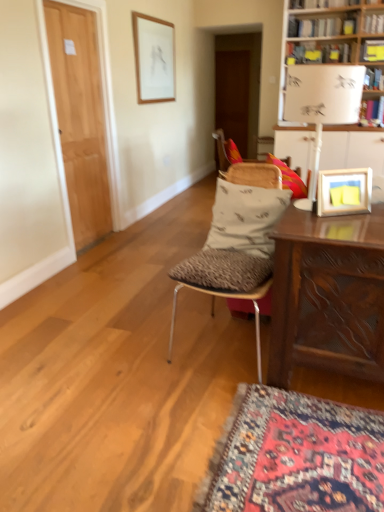
The width and height of the screenshot is (384, 512). What are the coordinates of `white paper lampshade at upper right` in the screenshot? It's located at (x=322, y=104).

What do you see at coordinates (322, 104) in the screenshot? I see `white paper lampshade at upper right` at bounding box center [322, 104].

This screenshot has height=512, width=384. I want to click on mahogany wood desk at right, so click(x=328, y=295).

Describe the element at coordinates (326, 34) in the screenshot. The width and height of the screenshot is (384, 512). I see `white cardboard bookcase at upper right` at that location.

Locate an element on the screen. yellow paper at upper right, arranged as the third book when viewed from the top is located at coordinates (372, 51).

Image resolution: width=384 pixels, height=512 pixels. I want to click on metallic silver chair at center, positioned as the 1th chair in front-to-back order, so click(x=225, y=282).

This screenshot has width=384, height=512. Identify the location of white paper lampshade at upper right. (322, 104).

From the image's perspective, is metallic silver chair at center, positioned as the 1th chair in front-to-back order, located beneath white cardboard bookcase at upper right?

Indeed, from the image's perspective, metallic silver chair at center, positioned as the 1th chair in front-to-back order, is shown beneath white cardboard bookcase at upper right.

Is metallic silver chair at center, positioned as the 1th chair in front-to-back order, wider or thinner than white cardboard bookcase at upper right?

metallic silver chair at center, positioned as the 1th chair in front-to-back order, is wider than white cardboard bookcase at upper right.

Is metallic silver chair at center, which ranks as the second chair in back-to-front order, closer to the viewer compared to white cardboard bookcase at upper right?

Yes, metallic silver chair at center, which ranks as the second chair in back-to-front order, is in front of white cardboard bookcase at upper right.

Are white fabric-covered chair at center, positioned as the second chair in front-to-back order, and light brown wood door at left, which is the 1th door in left-to-right order, making contact?

No, white fabric-covered chair at center, positioned as the second chair in front-to-back order, is not beside light brown wood door at left, which is the 1th door in left-to-right order.

Between white fabric-covered chair at center, the 1th chair when ordered from back to front, and light brown wood door at left, placed as the 2th door when sorted from back to front, which one has less height?

With less height is white fabric-covered chair at center, the 1th chair when ordered from back to front.

Is white fabric-covered chair at center, positioned as the second chair in front-to-back order, closer to camera compared to light brown wood door at left, placed as the 2th door when sorted from back to front?

No, it is behind light brown wood door at left, placed as the 2th door when sorted from back to front.

Is white fabric-covered chair at center, the 1th chair when ordered from back to front, facing towards light brown wood door at left, the 1th door in the bottom-to-top sequence?

No.

Is light brown wood door at left, which is the 1th door in left-to-right order, bigger than hardcover book at upper right, placed as the 3th book when sorted from bottom to top?

Indeed, light brown wood door at left, which is the 1th door in left-to-right order, has a larger size compared to hardcover book at upper right, placed as the 3th book when sorted from bottom to top.

Between light brown wood door at left, which is the 1th door in left-to-right order, and hardcover book at upper right, placed as the 3th book when sorted from bottom to top, which one has larger width?

With larger width is hardcover book at upper right, placed as the 3th book when sorted from bottom to top.

From a real-world perspective, is light brown wood door at left, the 1th door in the bottom-to-top sequence, on hardcover book at upper right, the 1th book when ordered from top to bottom?

No, from a real-world perspective, light brown wood door at left, the 1th door in the bottom-to-top sequence, is not above hardcover book at upper right, the 1th book when ordered from top to bottom.

From the image's perspective, between white paper lampshade at upper right and metallic silver chair at center, positioned as the 1th chair in front-to-back order, which one is located above?

white paper lampshade at upper right, from the image's perspective.

Is white paper lampshade at upper right at the left side of metallic silver chair at center, which ranks as the second chair in back-to-front order?

No, white paper lampshade at upper right is not to the left of metallic silver chair at center, which ranks as the second chair in back-to-front order.

The image size is (384, 512). Identify the location of lamp above the metallic silver chair at center, positioned as the 1th chair in front-to-back order (from the image's perspective). (322, 104).

Which of these two, white paper lampshade at upper right or metallic silver chair at center, positioned as the 1th chair in front-to-back order, is smaller?

With smaller size is white paper lampshade at upper right.

Does metallic silver chair at center, which ranks as the second chair in back-to-front order, turn towards matte white picture frame at upper center, the first picture frame from the left?

No, metallic silver chair at center, which ranks as the second chair in back-to-front order, is not turned towards matte white picture frame at upper center, the first picture frame from the left.

Which is in front, point (224, 262) or point (153, 102)?

The point (224, 262) is more forward.

Is metallic silver chair at center, which ranks as the second chair in back-to-front order, outside of matte white picture frame at upper center, the second picture frame ordered from the bottom?

Yes, metallic silver chair at center, which ranks as the second chair in back-to-front order, is located beyond the bounds of matte white picture frame at upper center, the second picture frame ordered from the bottom.

Which of these two, metallic silver chair at center, positioned as the 1th chair in front-to-back order, or matte white picture frame at upper center, the second picture frame ordered from the bottom, is smaller?

With smaller size is matte white picture frame at upper center, the second picture frame ordered from the bottom.

How many degrees apart are the facing directions of metallic silver chair at center, which ranks as the second chair in back-to-front order, and yellow paper at upper right, arranged as the third book when viewed from the top?

5.54 degrees separate the facing orientations of metallic silver chair at center, which ranks as the second chair in back-to-front order, and yellow paper at upper right, arranged as the third book when viewed from the top.

Is metallic silver chair at center, which ranks as the second chair in back-to-front order, far away from yellow paper at upper right, which ranks as the 1th book in bottom-to-top order?

Yes, metallic silver chair at center, which ranks as the second chair in back-to-front order, and yellow paper at upper right, which ranks as the 1th book in bottom-to-top order, are located far from each other.

Based on the photo, could yellow paper at upper right, arranged as the third book when viewed from the top, be considered to be inside metallic silver chair at center, positioned as the 1th chair in front-to-back order?

No, metallic silver chair at center, positioned as the 1th chair in front-to-back order, does not contain yellow paper at upper right, arranged as the third book when viewed from the top.

From the image's perspective, which is above, metallic silver chair at center, which ranks as the second chair in back-to-front order, or yellow paper at upper right, which ranks as the 1th book in bottom-to-top order?

yellow paper at upper right, which ranks as the 1th book in bottom-to-top order, appears higher in the image.

Does point (356, 278) appear closer or farther from the camera than point (378, 57)?

Point (356, 278) appears to be closer to the viewer than point (378, 57).

Which is correct: mahogany wood desk at right is inside yellow paper at upper right, arranged as the third book when viewed from the top, or outside of it?

mahogany wood desk at right cannot be found inside yellow paper at upper right, arranged as the third book when viewed from the top.

Identify the location of desk below the yellow paper at upper right, which ranks as the 1th book in bottom-to-top order (from a real-world perspective). The height and width of the screenshot is (512, 384). (328, 295).

I want to click on the 2nd chair in front of the white cardboard bookcase at upper right, so click(x=225, y=282).

Locate an element on the screen. Image resolution: width=384 pixels, height=512 pixels. the 1st chair below when counting from the light brown wood door at left, the second door positioned from the top (from the image's perspective) is located at coordinates (227, 151).

Which object lies nearer to the anchor point white fabric-covered chair at center, positioned as the second chair in front-to-back order, matte white picture frame at upper center, the first picture frame from the left, or hardcover book at upper right, the 1th book when ordered from top to bottom?

matte white picture frame at upper center, the first picture frame from the left, is closer to white fabric-covered chair at center, positioned as the second chair in front-to-back order.

Based on their spatial positions, is wooden picture frame at upper right, which is the 1th picture frame from right to left, or white fabric-covered chair at center, positioned as the second chair in front-to-back order, further from white cardboard bookcase at upper right?

white fabric-covered chair at center, positioned as the second chair in front-to-back order.

Which object lies nearer to the anchor point mahogany wood desk at right, wooden picture frame at upper right, the 1th picture frame positioned from the front, or white cardboard bookcase at upper right?

Based on the image, wooden picture frame at upper right, the 1th picture frame positioned from the front, appears to be nearer to mahogany wood desk at right.

In the scene shown: Which object lies nearer to the anchor point yellow paper at upper right, arranged as the third book when viewed from the top, white paper lampshade at upper right or matte white picture frame at upper center, the second picture frame positioned from the front?

white paper lampshade at upper right.

Based on the photo, which object lies further to the anchor point wooden picture frame at upper right, acting as the 2th picture frame starting from the top, metallic silver chair at center, positioned as the 1th chair in front-to-back order, or brown wooden door at center, marked as the second door in a front-to-back arrangement?

brown wooden door at center, marked as the second door in a front-to-back arrangement, is further to wooden picture frame at upper right, acting as the 2th picture frame starting from the top.

From the image, which object appears to be farther from light brown wood door at left, the 1th door viewed from the front, white paper lampshade at upper right or patterned fabric pillow at center?

white paper lampshade at upper right is further to light brown wood door at left, the 1th door viewed from the front.

Based on their spatial positions, is white wooden table at upper right or white fabric-covered chair at center, the 1th chair when ordered from back to front, further from yellow paper at upper right, arranged as the third book when viewed from the top?

white fabric-covered chair at center, the 1th chair when ordered from back to front.

From the image, which object appears to be farther from yellow paper at upper right, arranged as the third book when viewed from the top, mahogany wood desk at right or metallic silver chair at center, positioned as the 1th chair in front-to-back order?

metallic silver chair at center, positioned as the 1th chair in front-to-back order, is positioned further to the anchor yellow paper at upper right, arranged as the third book when viewed from the top.

Identify the location of bookcase located between metallic silver chair at center, which ranks as the second chair in back-to-front order, and hardcover book at upper center, which is the second book in top-to-bottom order, in the depth direction. The height and width of the screenshot is (512, 384). (326, 34).

You are a GUI agent. You are given a task and a screenshot of the screen. Output one action in this format:
    pyautogui.click(x=<x>, y=<y>)
    Task: Click on the chair between metallic silver chair at center, positioned as the 1th chair in front-to-back order, and matte white picture frame at upper center, the first picture frame positioned from the back, from front to back
    
    Given the screenshot: What is the action you would take?
    pyautogui.click(x=227, y=151)

What are the coordinates of `bookcase between white paper lampshade at upper right and yellow paper at upper right, arranged as the third book when viewed from the top, in the front-back direction` in the screenshot? It's located at (326, 34).

In order to click on pillow positioned between mahogany wood desk at right and yellow paper at upper right, arranged as the third book when viewed from the top, from near to far in this screenshot , I will do `click(245, 217)`.